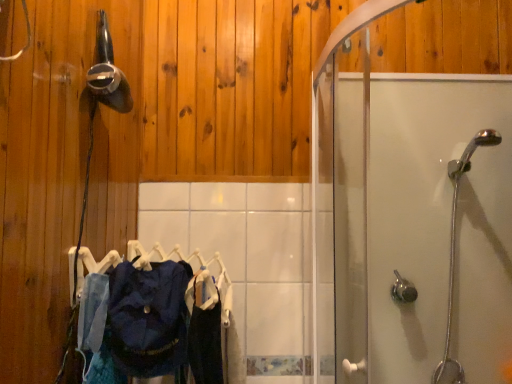
Question: Considering their positions, is satin nickel shower handle at lower right, the second shower when ordered from left to right, located in front of or behind dark blue fabric at center, the second clothing when ordered from left to right?

Choices:
 (A) behind
 (B) front

Answer: (A)

Question: Is point (410, 294) closer or farther from the camera than point (206, 352)?

Choices:
 (A) farther
 (B) closer

Answer: (A)

Question: Which of these objects is positioned closest to the satin nickel shower handle at lower right, the second shower when ordered from left to right?

Choices:
 (A) dark blue fabric at center, which is counted as the second clothing, starting from the right
 (B) transparent glass shower door at right
 (C) chrome metallic showerhead at right, which ranks as the 3th shower in left-to-right order
 (D) dark blue fabric at center, the second clothing when ordered from left to right
 (E) metallic silver hairdryer at upper left, which is counted as the 1th shower, starting from the top

Answer: (C)

Question: Based on their relative distances, which object is farther from the blue fabric clothes at center?

Choices:
 (A) dark blue fabric at center, the first clothing in the left-to-right sequence
 (B) metallic silver hairdryer at upper left, which is counted as the 1th shower, starting from the top
 (C) satin nickel shower handle at lower right, which is the 2th shower from right to left
 (D) dark blue fabric at center, acting as the 1th clothing starting from the right
 (E) chrome metallic showerhead at right, which ranks as the 3th shower in left-to-right order

Answer: (E)